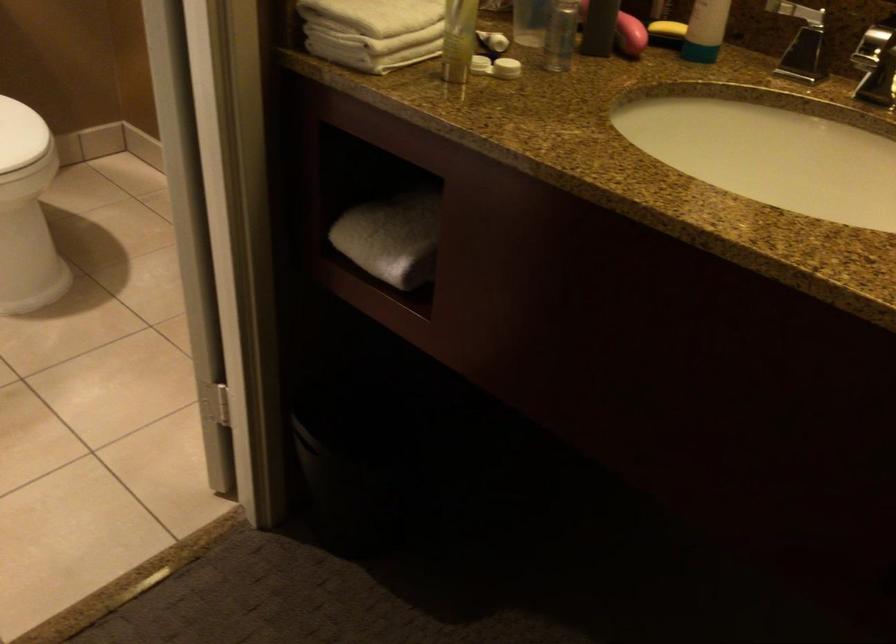
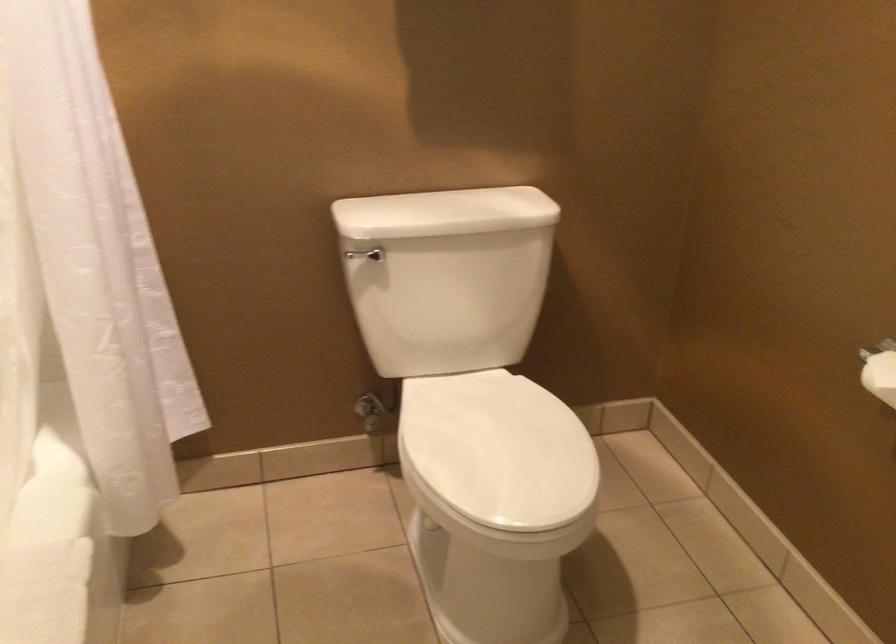
Question: The camera is either moving clockwise (left) or counter-clockwise (right) around the object. The first image is from the beginning of the video and the second image is from the end. Is the camera moving left or right when shooting the video?

Choices:
 (A) Left
 (B) Right

Answer: (B)